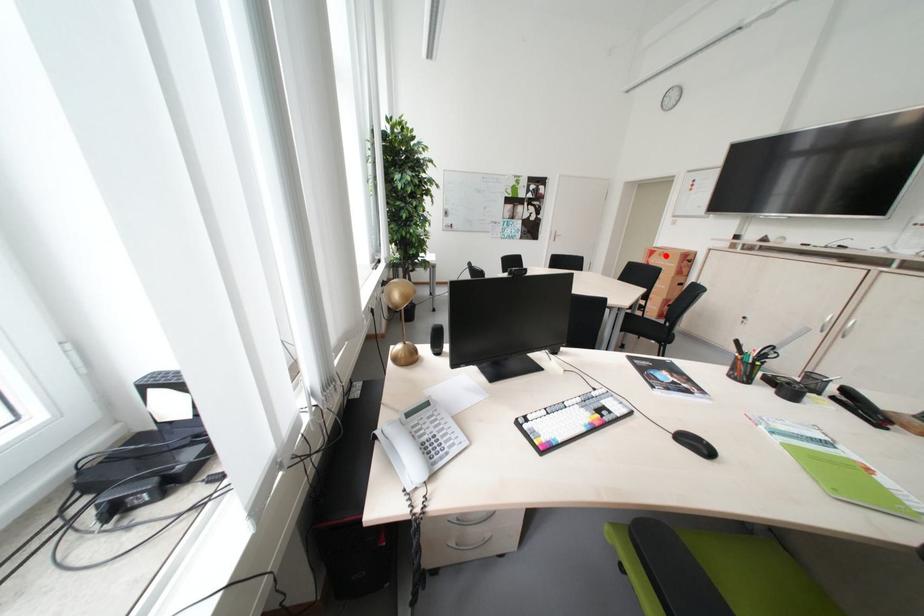
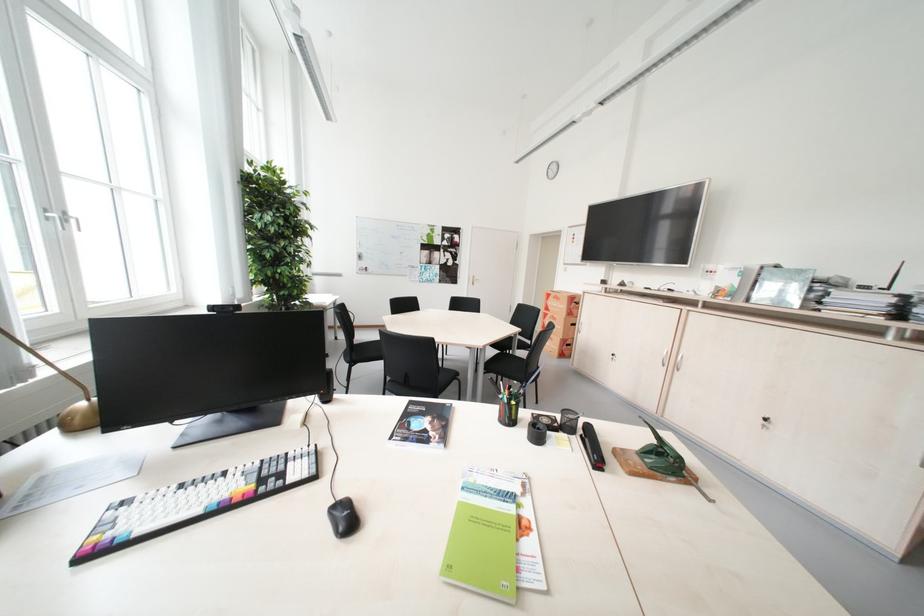
Locate, in the second image, the point that corresponds to the highlighted location in the first image.

(561, 299)